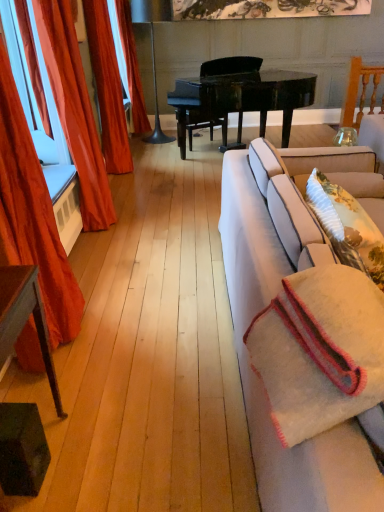
Describe the element at coordinates (74, 109) in the screenshot. Image resolution: width=384 pixels, height=512 pixels. I see `velvet orange curtain at left, placed as the second curtain when sorted from front to back` at that location.

Measure the distance between white fabric couch at right and camera.

A distance of 31.70 inches exists between white fabric couch at right and camera.

This screenshot has width=384, height=512. What are the coordinates of `white fabric couch at right` in the screenshot? It's located at (260, 382).

What do you see at coordinates (32, 217) in the screenshot? I see `velvet orange curtain at left, which is the 1th curtain from front to back` at bounding box center [32, 217].

Identify the location of orange fabric curtain at left, the 1th curtain positioned from the back. Image resolution: width=384 pixels, height=512 pixels. (132, 67).

Does point (120, 20) lie in front of point (27, 221)?

No, (120, 20) is further to viewer.

Does orange fabric curtain at left, the fourth curtain in the front-to-back sequence, turn towards velvet orange curtain at left, positioned as the fourth curtain in back-to-front order?

No, orange fabric curtain at left, the fourth curtain in the front-to-back sequence, is not facing towards velvet orange curtain at left, positioned as the fourth curtain in back-to-front order.

Measure the distance from orange fabric curtain at left, the fourth curtain in the front-to-back sequence, to velvet orange curtain at left, positioned as the fourth curtain in back-to-front order.

The distance of orange fabric curtain at left, the fourth curtain in the front-to-back sequence, from velvet orange curtain at left, positioned as the fourth curtain in back-to-front order, is 14.99 feet.

Based on the photo, from a real-world perspective, which object stands above the other?

orange fabric curtain at left, the 1th curtain positioned from the back, from a real-world perspective.

Can you confirm if velvet orange curtain at left, which appears as the third curtain when viewed from the back, is shorter than white fabric couch at right?

No, velvet orange curtain at left, which appears as the third curtain when viewed from the back, is not shorter than white fabric couch at right.

From the image's perspective, which one is positioned higher, velvet orange curtain at left, placed as the second curtain when sorted from front to back, or white fabric couch at right?

From the image's view, velvet orange curtain at left, placed as the second curtain when sorted from front to back, is above.

Which is behind, velvet orange curtain at left, which appears as the third curtain when viewed from the back, or white fabric couch at right?

velvet orange curtain at left, which appears as the third curtain when viewed from the back, is further away from the camera.

Is velvet orange curtain at left, placed as the second curtain when sorted from front to back, outside of white fabric couch at right?

That's correct, velvet orange curtain at left, placed as the second curtain when sorted from front to back, is outside of white fabric couch at right.

From a real-world perspective, is velvet orange curtain at left, positioned as the fourth curtain in back-to-front order, positioned under green painted wood side table at lower left based on gravity?

Actually, velvet orange curtain at left, positioned as the fourth curtain in back-to-front order, is physically above green painted wood side table at lower left in the real world.

Looking at this image, which point is more distant from viewer, (34,218) or (10,321)?

The point (34,218) is behind.

Can you confirm if velvet orange curtain at left, positioned as the fourth curtain in back-to-front order, is smaller than green painted wood side table at lower left?

Actually, velvet orange curtain at left, positioned as the fourth curtain in back-to-front order, might be larger than green painted wood side table at lower left.

Does velvet orange curtain at left, positioned as the fourth curtain in back-to-front order, have a greater width compared to green painted wood side table at lower left?

Yes.

From the image's perspective, is white woven blanket at right on orange fabric curtain at left, the 1th curtain positioned from the back?

No, from the image's perspective, white woven blanket at right is not on top of orange fabric curtain at left, the 1th curtain positioned from the back.

Looking at their sizes, would you say white woven blanket at right is wider or thinner than orange fabric curtain at left, the 1th curtain positioned from the back?

In the image, white woven blanket at right appears to be wider than orange fabric curtain at left, the 1th curtain positioned from the back.

How many degrees apart are the facing directions of white woven blanket at right and orange fabric curtain at left, the 1th curtain positioned from the back?

The facing directions of white woven blanket at right and orange fabric curtain at left, the 1th curtain positioned from the back, are 0.222 degrees apart.

Is white woven blanket at right facing towards orange fabric curtain at left, the 1th curtain positioned from the back?

No, white woven blanket at right is not facing towards orange fabric curtain at left, the 1th curtain positioned from the back.

Is point (346, 192) farther from camera compared to point (100, 197)?

No.

Is fluffy beige pillow at right oriented towards velvet orange curtain at left, which appears as the third curtain when viewed from the back?

No, fluffy beige pillow at right is not turned towards velvet orange curtain at left, which appears as the third curtain when viewed from the back.

Considering the relative sizes of fluffy beige pillow at right and velvet orange curtain at left, placed as the second curtain when sorted from front to back, in the image provided, is fluffy beige pillow at right thinner than velvet orange curtain at left, placed as the second curtain when sorted from front to back,?

No, fluffy beige pillow at right is not thinner than velvet orange curtain at left, placed as the second curtain when sorted from front to back.

Where is `pillow lying in front of the velvet orange curtain at left, placed as the second curtain when sorted from front to back`? This screenshot has height=512, width=384. pillow lying in front of the velvet orange curtain at left, placed as the second curtain when sorted from front to back is located at coordinates (347, 226).

Locate an element on the screen. Image resolution: width=384 pixels, height=512 pixels. the 4th curtain located above the white fabric couch at right (from a real-world perspective) is located at coordinates (132, 67).

Is orange fabric curtain at left, the 1th curtain positioned from the back, positioned beyond the bounds of white fabric couch at right?

Indeed, orange fabric curtain at left, the 1th curtain positioned from the back, is completely outside white fabric couch at right.

From a real-world perspective, is orange fabric curtain at left, the 1th curtain positioned from the back, on top of white fabric couch at right?

Indeed, from a real-world perspective, orange fabric curtain at left, the 1th curtain positioned from the back, stands above white fabric couch at right.

Considering the relative sizes of orange fabric curtain at left, the 1th curtain positioned from the back, and white fabric couch at right in the image provided, is orange fabric curtain at left, the 1th curtain positioned from the back, taller than white fabric couch at right?

Indeed, orange fabric curtain at left, the 1th curtain positioned from the back, has a greater height compared to white fabric couch at right.

How many degrees apart are the facing directions of green painted wood side table at lower left and white woven blanket at right?

The facing directions of green painted wood side table at lower left and white woven blanket at right are 1.25 degrees apart.

From a real-world perspective, is green painted wood side table at lower left on white woven blanket at right?

Actually, green painted wood side table at lower left is physically below white woven blanket at right in the real world.

The width and height of the screenshot is (384, 512). I want to click on table below the white woven blanket at right (from the image's perspective), so click(x=25, y=318).

Which curtain is the 2nd one when counting from the right side of the orange fabric curtain at left, the 1th curtain positioned from the back? Please provide its 2D coordinates.

[(32, 217)]

Where is `studio couch below the velvet orange curtain at left, placed as the second curtain when sorted from front to back (from the image's perspective)`? studio couch below the velvet orange curtain at left, placed as the second curtain when sorted from front to back (from the image's perspective) is located at coordinates (260, 382).

Based on their spatial positions, is black glossy piano at center or green painted wood side table at lower left closer to fluffy beige pillow at right?

green painted wood side table at lower left.

Looking at the image, which one is located closer to black glossy piano at center, orange fabric curtain at left, the 1th curtain positioned from the back, or white woven blanket at right?

orange fabric curtain at left, the 1th curtain positioned from the back, lies closer to black glossy piano at center than the other object.

When comparing their distances from white woven blanket at right, does velvet orange curtain at left, which appears as the third curtain when viewed from the back, or velvet orange curtain at left, which is the 1th curtain from front to back, seem further?

velvet orange curtain at left, which appears as the third curtain when viewed from the back, is positioned further to the anchor white woven blanket at right.

Estimate the real-world distances between objects in this image. Which object is closer to white fabric couch at right, fluffy beige pillow at right or shiny orange curtain at left, arranged as the 2th curtain when viewed from the back?

fluffy beige pillow at right is closer to white fabric couch at right.

From the image, which object appears to be nearer to green painted wood side table at lower left, velvet orange curtain at left, positioned as the fourth curtain in back-to-front order, or fluffy beige pillow at right?

The object closer to green painted wood side table at lower left is velvet orange curtain at left, positioned as the fourth curtain in back-to-front order.

Looking at the image, which one is located further to orange fabric curtain at left, the 1th curtain positioned from the back, shiny orange curtain at left, marked as the third curtain in a front-to-back arrangement, or green painted wood side table at lower left?

The object further to orange fabric curtain at left, the 1th curtain positioned from the back, is green painted wood side table at lower left.

Estimate the real-world distances between objects in this image. Which object is closer to shiny orange curtain at left, arranged as the 2th curtain when viewed from the back, velvet orange curtain at left, which appears as the third curtain when viewed from the back, or velvet orange curtain at left, which is the 1th curtain from front to back?

Based on the image, velvet orange curtain at left, which appears as the third curtain when viewed from the back, appears to be nearer to shiny orange curtain at left, arranged as the 2th curtain when viewed from the back.

Which object lies nearer to the anchor point shiny orange curtain at left, marked as the third curtain in a front-to-back arrangement, white fabric couch at right or velvet orange curtain at left, which appears as the third curtain when viewed from the back?

Among the two, velvet orange curtain at left, which appears as the third curtain when viewed from the back, is located nearer to shiny orange curtain at left, marked as the third curtain in a front-to-back arrangement.

Where is `curtain positioned between fluffy beige pillow at right and black glossy piano at center from near to far`? curtain positioned between fluffy beige pillow at right and black glossy piano at center from near to far is located at coordinates (74, 109).

You are a GUI agent. You are given a task and a screenshot of the screen. Output one action in this format:
    pyautogui.click(x=<x>, y=<y>)
    Task: Click on the piano between white woven blanket at right and shiny orange curtain at left, arranged as the 2th curtain when viewed from the back, along the z-axis
    
    Given the screenshot: What is the action you would take?
    pyautogui.click(x=241, y=99)

Locate an element on the screen. pillow between white fabric couch at right and shiny orange curtain at left, arranged as the 2th curtain when viewed from the back, in the front-back direction is located at coordinates point(347,226).

The width and height of the screenshot is (384, 512). Identify the location of blanket located between white fabric couch at right and shiny orange curtain at left, arranged as the 2th curtain when viewed from the back, in the depth direction. (319, 350).